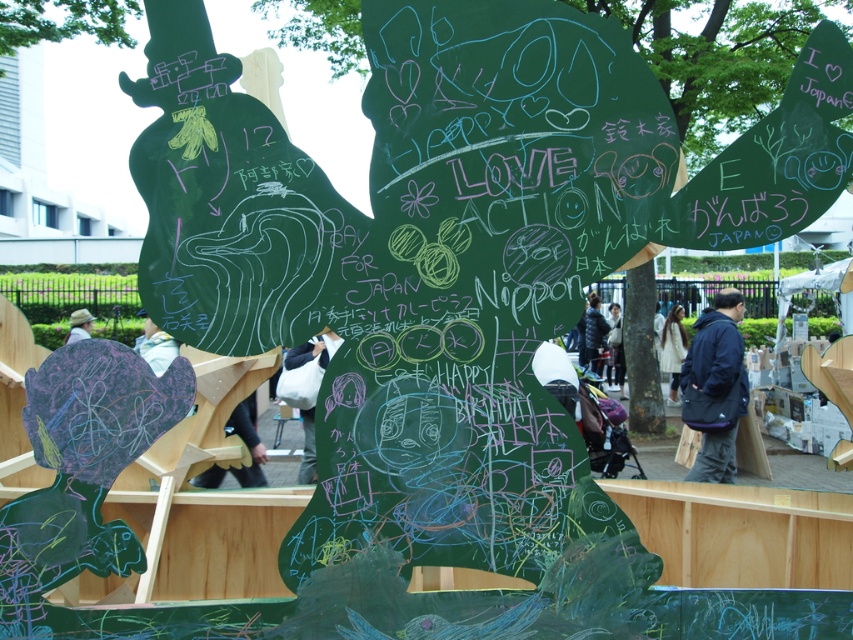
Question: Is dark blue jacket at center bigger than white fabric bag at center?

Choices:
 (A) yes
 (B) no

Answer: (B)

Question: Estimate the real-world distances between objects in this image. Which object is closer to the dark blue fabric bag at right?

Choices:
 (A) light brown straw hat at lower left
 (B) white fabric at center

Answer: (B)

Question: Which of the following is the closest to the observer?

Choices:
 (A) dark blue fabric bag at right
 (B) dark blue jacket at center
 (C) white fabric at center
 (D) light brown straw hat at lower left

Answer: (A)

Question: Can you confirm if white fabric at center is positioned above light brown straw hat at lower left?

Choices:
 (A) no
 (B) yes

Answer: (A)

Question: Which of the following is the farthest from the observer?

Choices:
 (A) dark blue jacket at center
 (B) white fabric bag at center
 (C) dark blue fabric bag at right
 (D) white fabric at center

Answer: (A)

Question: Is dark blue fabric bag at right above white fabric at center?

Choices:
 (A) no
 (B) yes

Answer: (A)